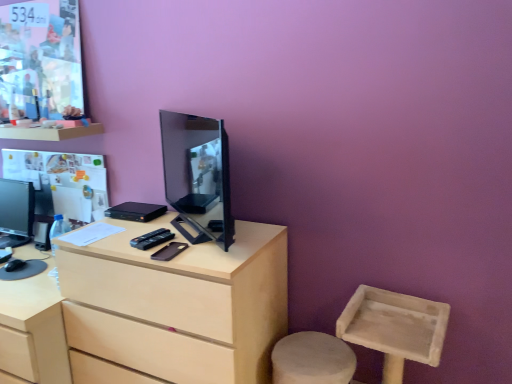
You are a GUI agent. You are given a task and a screenshot of the screen. Output one action in this format:
    pyautogui.click(x=<x>, y=<y>)
    Task: Click on the free space to the back side of black matte mobile phone at center
    
    Given the screenshot: What is the action you would take?
    (168, 235)